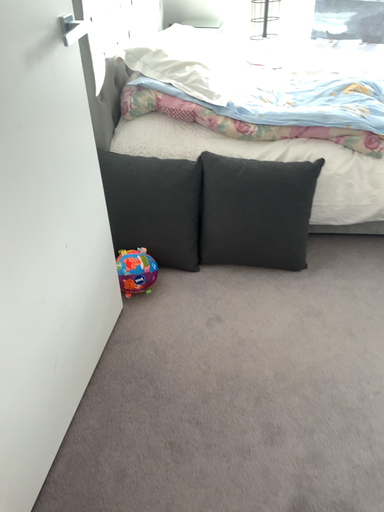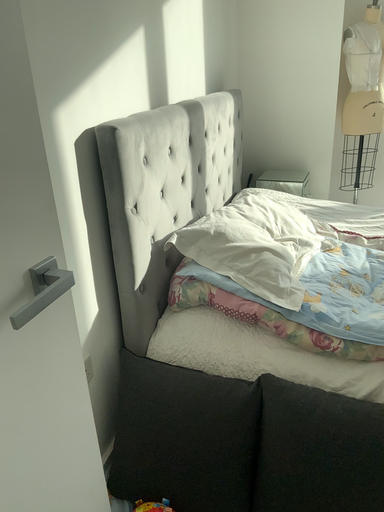
Question: How did the camera likely rotate when shooting the video?

Choices:
 (A) rotated right
 (B) rotated left

Answer: (B)